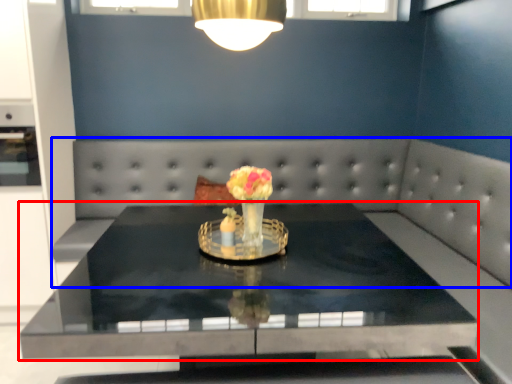
Question: Which of the following is the closest to the observer, table (highlighted by a red box) or couch (highlighted by a blue box)?

Choices:
 (A) table
 (B) couch

Answer: (A)